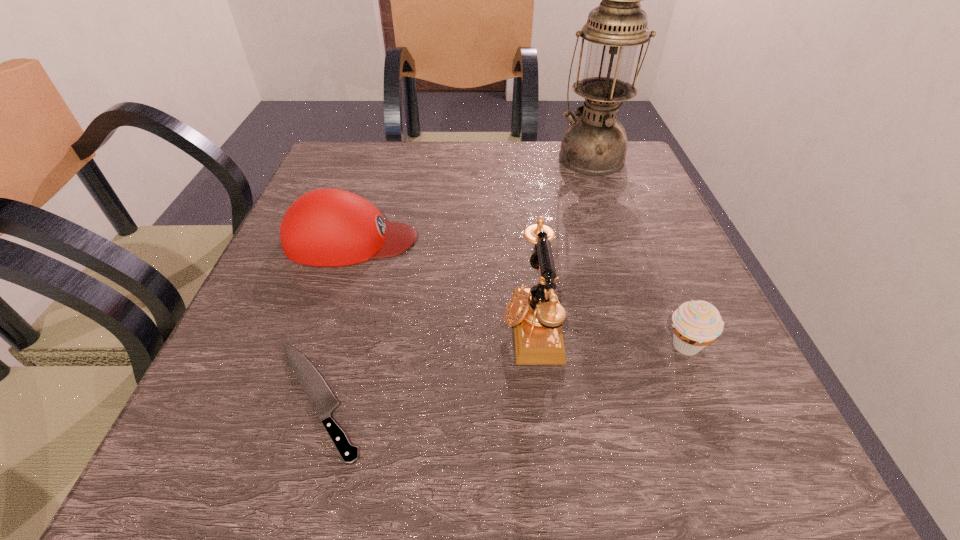
This screenshot has height=540, width=960. Identify the location of object situated at the near left corner. (323, 401).

Identify the location of object present at the far right corner. (595, 143).

Where is `free space at the far edge`? The height and width of the screenshot is (540, 960). free space at the far edge is located at coordinates (514, 147).

Where is `vacant area at the near edge of the desktop`? This screenshot has width=960, height=540. vacant area at the near edge of the desktop is located at coordinates (399, 458).

The width and height of the screenshot is (960, 540). In the image, there is a desktop. In order to click on vacant space at the left edge in this screenshot , I will do `click(300, 336)`.

Where is `free spot at the right edge of the desktop`? free spot at the right edge of the desktop is located at coordinates (612, 244).

Locate an element on the screen. The image size is (960, 540). vacant region at the far left corner is located at coordinates (377, 158).

Image resolution: width=960 pixels, height=540 pixels. In order to click on vacant region at the near left corner in this screenshot , I will do `click(255, 496)`.

Image resolution: width=960 pixels, height=540 pixels. In the image, there is a desktop. Identify the location of blank space at the near right corner. (756, 490).

Find the location of `unoccupied position between the shortest object and the baseball cap`. unoccupied position between the shortest object and the baseball cap is located at coordinates (334, 320).